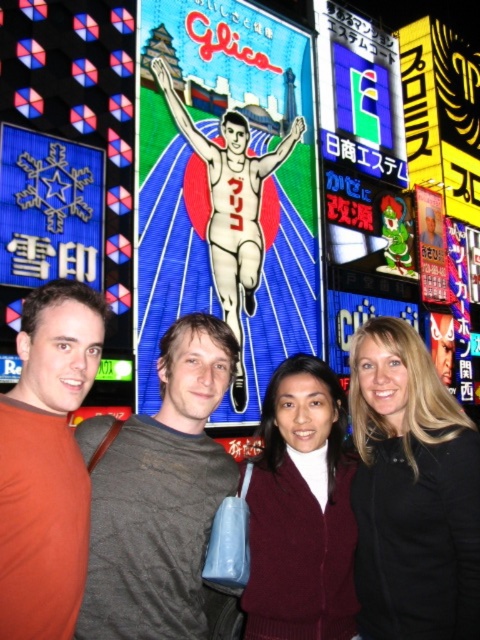
Question: From the image, what is the correct spatial relationship of black matte jacket at right in relation to orange t-shirt at left?

Choices:
 (A) below
 (B) above

Answer: (A)

Question: Does colorful digital screen at center appear on the left side of neon sign at upper center?

Choices:
 (A) yes
 (B) no

Answer: (A)

Question: Among these objects, which one is nearest to the camera?

Choices:
 (A) burgundy sweater at center
 (B) neon sign at upper center
 (C) orange t-shirt at left

Answer: (C)

Question: Is blue glossy snowflake at upper left positioned behind neon sign at upper center?

Choices:
 (A) yes
 (B) no

Answer: (B)

Question: Among these objects, which one is nearest to the camera?

Choices:
 (A) blue glossy snowflake at upper left
 (B) colorful digital screen at center
 (C) orange t-shirt at left
 (D) gray cotton shirt at center

Answer: (C)

Question: Which is nearer to the gray cotton shirt at center?

Choices:
 (A) colorful digital screen at center
 (B) orange t-shirt at left
 (C) neon sign at upper center

Answer: (B)